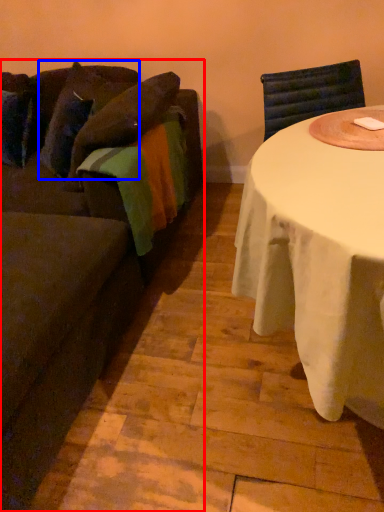
Question: Among these objects, which one is farthest to the camera, studio couch (highlighted by a red box) or pillow (highlighted by a blue box)?

Choices:
 (A) studio couch
 (B) pillow

Answer: (B)